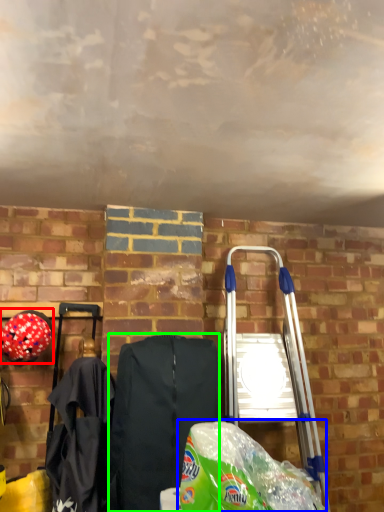
Question: Considering the real-world distances, which object is closest to helmet (highlighted by a red box)? grocery bag (highlighted by a blue box) or folding chair (highlighted by a green box).

Choices:
 (A) grocery bag
 (B) folding chair

Answer: (B)